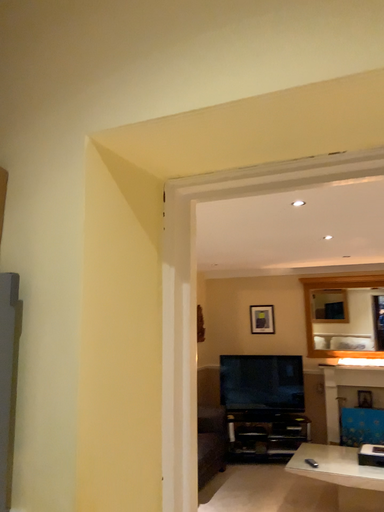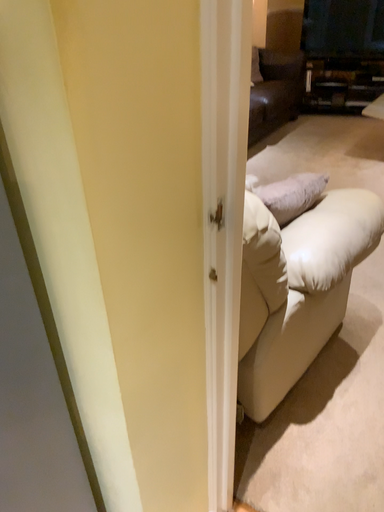
Question: Which way did the camera rotate in the video?

Choices:
 (A) rotated right
 (B) rotated left

Answer: (B)